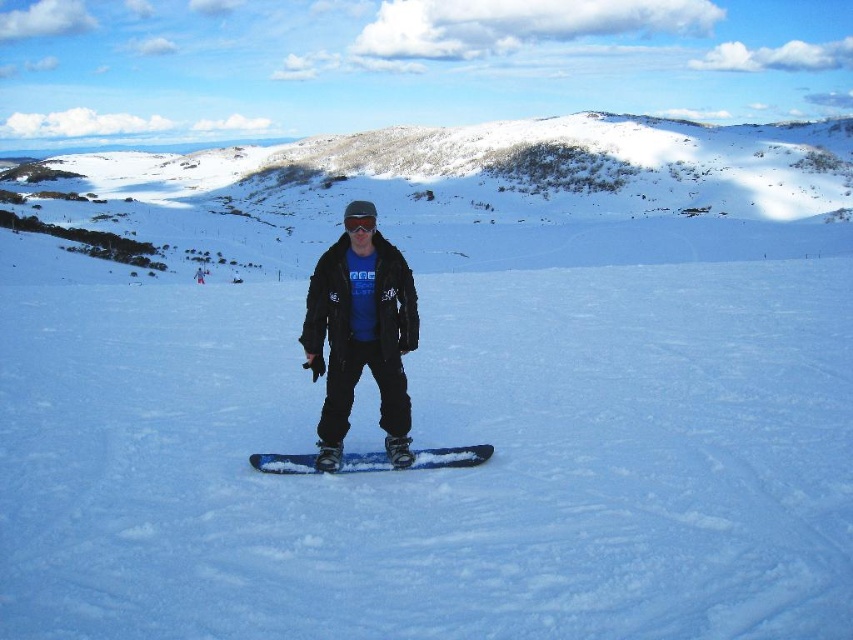
Is snowy/icy mountain at upper center below matte black snowboard at center?

No.

Identify the location of snowy/icy mountain at upper center. (519, 168).

Where is `snowy/icy mountain at upper center`? Image resolution: width=853 pixels, height=640 pixels. snowy/icy mountain at upper center is located at coordinates (519, 168).

Can you confirm if matte black snowboarder at center is positioned below blue matte snowboard at center?

No, matte black snowboarder at center is not below blue matte snowboard at center.

Can you confirm if matte black snowboarder at center is bigger than blue matte snowboard at center?

Yes, matte black snowboarder at center is bigger than blue matte snowboard at center.

Identify the location of matte black snowboarder at center. The image size is (853, 640). (361, 339).

Identify the location of matte black snowboarder at center. This screenshot has width=853, height=640. (361, 339).

Does snowy/icy mountain at upper center lie behind blue matte snowboard at center?

That is True.

Is snowy/icy mountain at upper center above blue matte snowboard at center?

Correct, snowy/icy mountain at upper center is located above blue matte snowboard at center.

Is point (619, 212) farther from viewer compared to point (296, 461)?

Yes, point (619, 212) is behind point (296, 461).

The width and height of the screenshot is (853, 640). What are the coordinates of `snowy/icy mountain at upper center` in the screenshot? It's located at (519, 168).